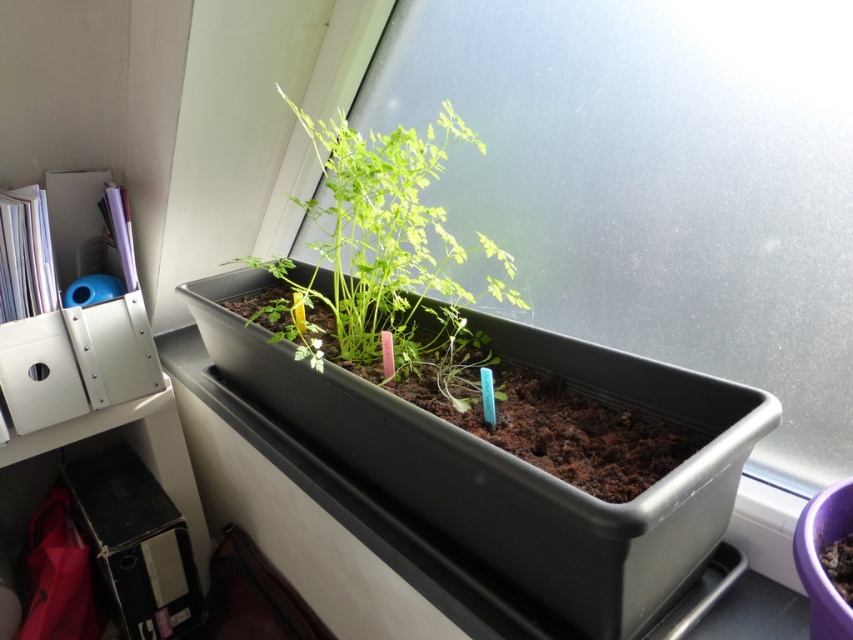
Question: Can you confirm if black plastic tray at center is wider than green matte plant at center?

Choices:
 (A) yes
 (B) no

Answer: (A)

Question: Is black plastic tray at center above green matte plant at center?

Choices:
 (A) yes
 (B) no

Answer: (B)

Question: Is black plastic tray at center positioned before green matte plant at center?

Choices:
 (A) yes
 (B) no

Answer: (A)

Question: Which of the following is the farthest from the observer?

Choices:
 (A) black plastic tray at center
 (B) green matte plant at center

Answer: (B)